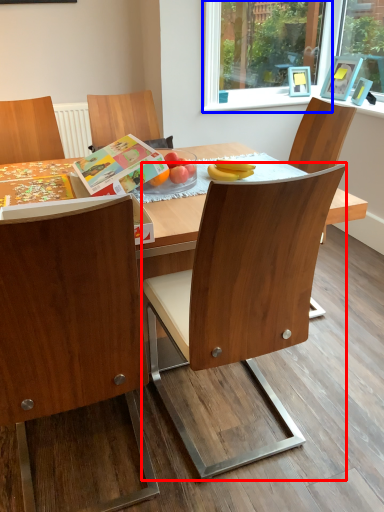
Question: Which object is further to the camera taking this photo, chair (highlighted by a red box) or window frame (highlighted by a blue box)?

Choices:
 (A) chair
 (B) window frame

Answer: (B)